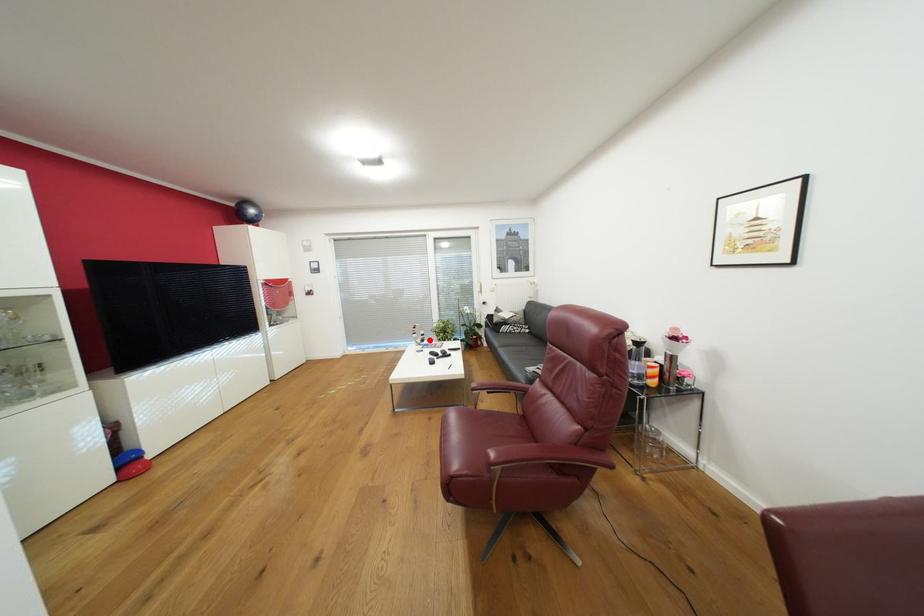
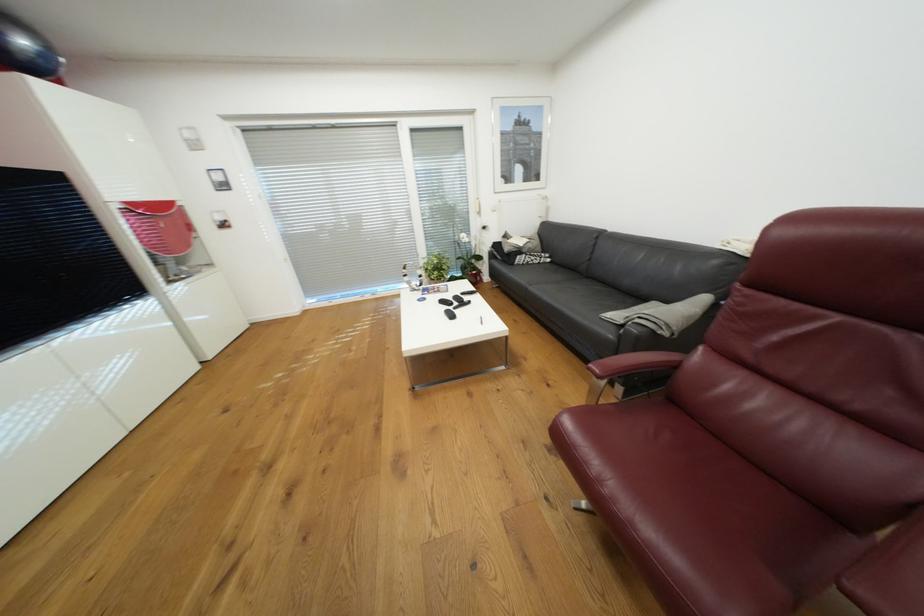
The point at the highlighted location is marked in the first image. Where is the corresponding point in the second image?

(427, 284)